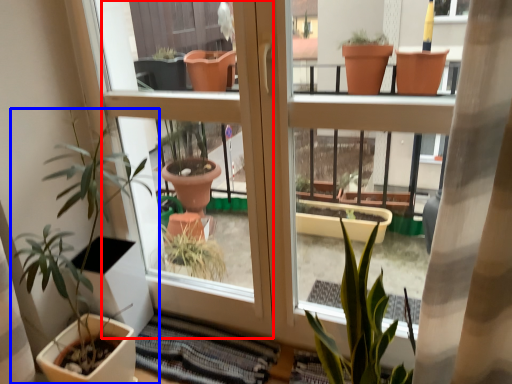
Question: Among these objects, which one is nearest to the camera, screen door (highlighted by a red box) or houseplant (highlighted by a blue box)?

Choices:
 (A) screen door
 (B) houseplant

Answer: (B)